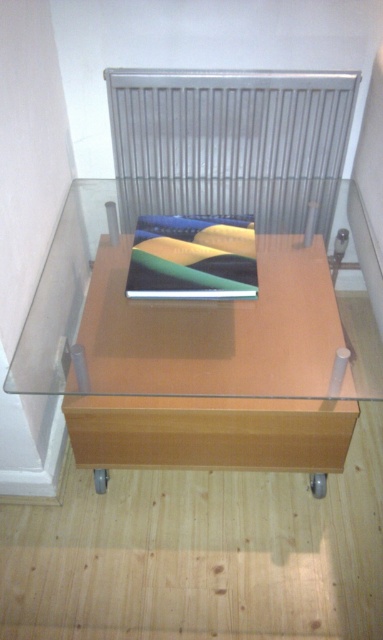
You are standing in a room and see the light brown wood table at center and the silver metallic radiator at upper center. Which object is positioned to the left when viewed from the front?

The light brown wood table at center is positioned to the left of the silver metallic radiator at upper center when viewed from the front.

You are moving a small potted plant that is 12 inches wide. You want to place it on the floor between the light brown wood table at center and the silver metallic radiator at upper center. Will there be enough space between them to fit the plant?

The light brown wood table at center is 16.31 inches from the silver metallic radiator at upper center. Since the plant is 12 inches wide, there is enough space between them to fit the plant as 12 inches is less than 16.31 inches.